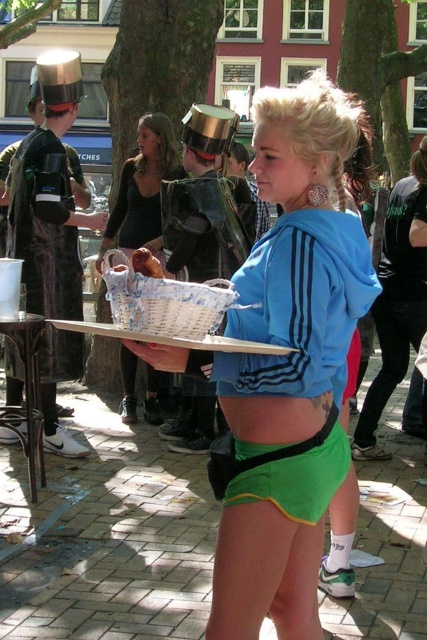
Does matte blue hoodie at center appear over matte black basket at center?

Actually, matte blue hoodie at center is below matte black basket at center.

Where is `matte blue hoodie at center`? The image size is (427, 640). matte blue hoodie at center is located at coordinates (289, 364).

Does matte blue hoodie at center appear on the left side of brushed metal hat at upper left?

In fact, matte blue hoodie at center is to the right of brushed metal hat at upper left.

Between matte blue hoodie at center and brushed metal hat at upper left, which one appears on the right side from the viewer's perspective?

Positioned to the right is matte blue hoodie at center.

Locate an element on the screen. The height and width of the screenshot is (640, 427). matte blue hoodie at center is located at coordinates (289, 364).

Is matte blue hoodie at center positioned before breadsoftbasket at center?

Yes, matte blue hoodie at center is closer to the viewer.

You are a GUI agent. You are given a task and a screenshot of the screen. Output one action in this format:
    pyautogui.click(x=<x>, y=<y>)
    Task: Click on the matte blue hoodie at center
    The height and width of the screenshot is (640, 427).
    Given the screenshot: What is the action you would take?
    pyautogui.click(x=289, y=364)

Is point (292, 92) less distant than point (151, 275)?

No, (292, 92) is further to viewer.

This screenshot has width=427, height=640. Identify the location of matte blue hoodie at center. (289, 364).